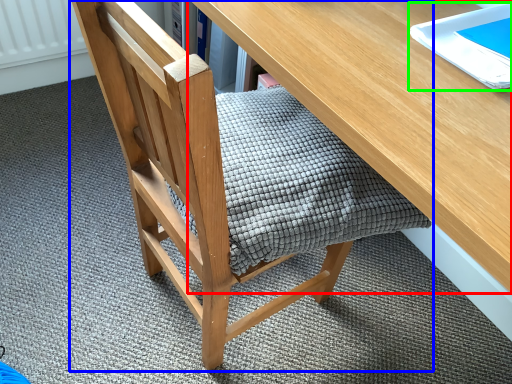
Question: Which object is the closest to the desk (highlighted by a red box)? Choose among these: chair (highlighted by a blue box) or notebook (highlighted by a green box).

Choices:
 (A) chair
 (B) notebook

Answer: (B)